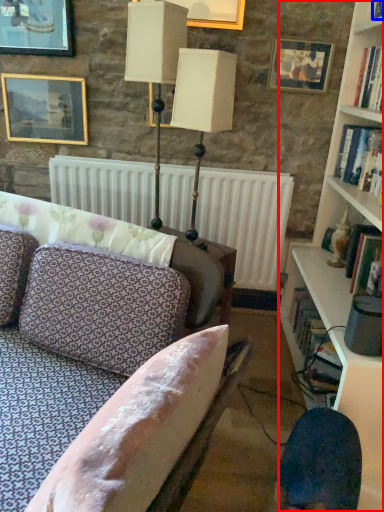
Question: Among these objects, which one is nearest to the camera, bookcase (highlighted by a red box) or book (highlighted by a blue box)?

Choices:
 (A) bookcase
 (B) book

Answer: (A)